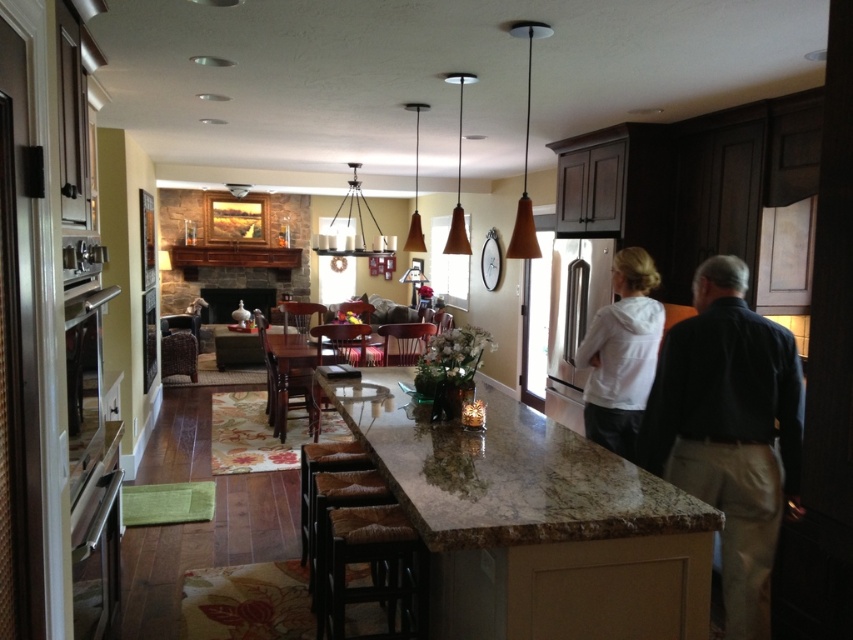
Is dark blue shirt at center to the right of white matte hoodie at center from the viewer's perspective?

Indeed, dark blue shirt at center is positioned on the right side of white matte hoodie at center.

Is point (694, 355) less distant than point (630, 259)?

Yes, it is.

I want to click on dark blue shirt at center, so click(x=728, y=426).

Is marble countertop at center above dark blue shirt at center?

Yes.

Which is in front, point (437, 493) or point (722, 589)?

Point (437, 493) is more forward.

The width and height of the screenshot is (853, 640). In order to click on marble countertop at center in this screenshot , I will do `click(503, 472)`.

Can you confirm if marble countertop at center is positioned to the left of white matte hoodie at center?

Yes, marble countertop at center is to the left of white matte hoodie at center.

Does marble countertop at center have a lesser width compared to white matte hoodie at center?

No.

You are a GUI agent. You are given a task and a screenshot of the screen. Output one action in this format:
    pyautogui.click(x=<x>, y=<y>)
    Task: Click on the marble countertop at center
    This screenshot has height=640, width=853.
    Given the screenshot: What is the action you would take?
    pyautogui.click(x=503, y=472)